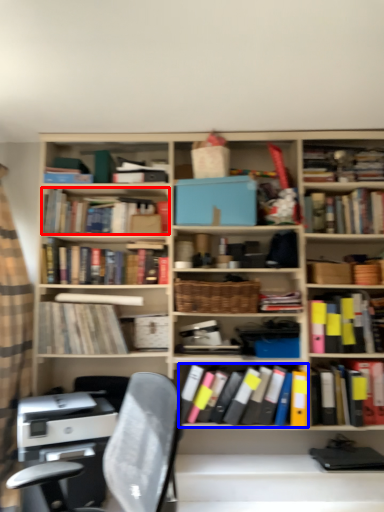
Question: Which object is closer to the camera taking this photo, book (highlighted by a red box) or book (highlighted by a blue box)?

Choices:
 (A) book
 (B) book

Answer: (B)